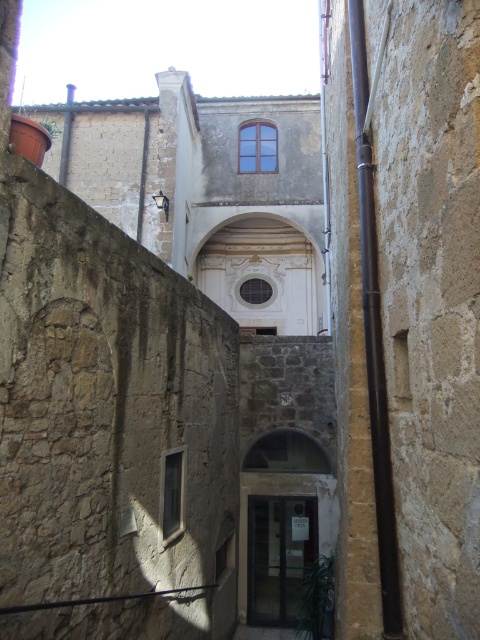
Question: Among these objects, which one is farthest from the camera?

Choices:
 (A) white marble archway at center
 (B) matte glass door at center

Answer: (A)

Question: Which point is closer to the camera taking this photo?

Choices:
 (A) (275, 317)
 (B) (276, 554)

Answer: (B)

Question: Is white marble archway at center below matte glass door at center?

Choices:
 (A) yes
 (B) no

Answer: (B)

Question: Does white marble archway at center have a lesser width compared to matte glass door at center?

Choices:
 (A) yes
 (B) no

Answer: (A)

Question: Where is white marble archway at center located in relation to matte glass door at center in the image?

Choices:
 (A) right
 (B) left

Answer: (A)